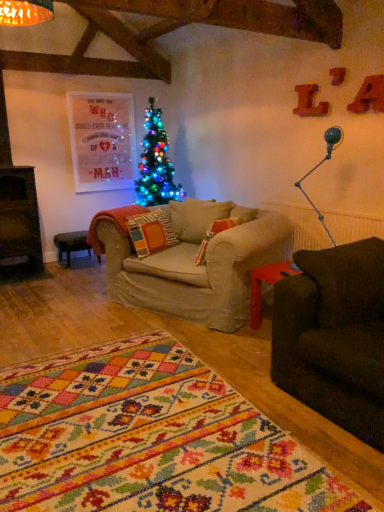
Describe the element at coordinates (319, 166) in the screenshot. I see `metallic blue lamp at right` at that location.

Where is `metallic blue lamp at right`? metallic blue lamp at right is located at coordinates (319, 166).

This screenshot has width=384, height=512. Describe the element at coordinates (71, 244) in the screenshot. I see `black leather stool at lower left` at that location.

Image resolution: width=384 pixels, height=512 pixels. I want to click on black leather stool at lower left, so click(71, 244).

Measure the distance between black leather stool at lower left and camera.

A distance of 4.59 meters exists between black leather stool at lower left and camera.

Locate an element on the screen. metallic blue lamp at right is located at coordinates (319, 166).

Which is more to the left, metallic blue lamp at right or black leather stool at lower left?

Positioned to the left is black leather stool at lower left.

In the image, is metallic blue lamp at right positioned in front of or behind black leather stool at lower left?

In the image, metallic blue lamp at right appears in front of black leather stool at lower left.

Is point (312, 206) farther from camera compared to point (74, 237)?

No, it is not.

From the image's perspective, is metallic blue lamp at right above black leather stool at lower left?

Yes, from the image's perspective, metallic blue lamp at right is on top of black leather stool at lower left.

From a real-world perspective, is metallic blue lamp at right over black leather stool at lower left?

Correct, in the physical world, metallic blue lamp at right is higher than black leather stool at lower left.

Considering the relative sizes of metallic blue lamp at right and black leather stool at lower left in the image provided, is metallic blue lamp at right thinner than black leather stool at lower left?

Indeed, metallic blue lamp at right has a lesser width compared to black leather stool at lower left.

Looking at this image, is metallic blue lamp at right shorter than black leather stool at lower left?

Incorrect, the height of metallic blue lamp at right does not fall short of that of black leather stool at lower left.

Who is smaller, metallic blue lamp at right or black leather stool at lower left?

metallic blue lamp at right is smaller.

Would you say metallic blue lamp at right is inside or outside black leather stool at lower left?

metallic blue lamp at right is located beyond the bounds of black leather stool at lower left.

Is metallic blue lamp at right directly adjacent to black leather stool at lower left?

metallic blue lamp at right and black leather stool at lower left are clearly separated.

Is metallic blue lamp at right oriented towards black leather stool at lower left?

No, metallic blue lamp at right does not turn towards black leather stool at lower left.

How different are the orientations of metallic blue lamp at right and black leather stool at lower left in degrees?

88 degrees separate the facing orientations of metallic blue lamp at right and black leather stool at lower left.

In order to click on lamp in front of the black leather stool at lower left in this screenshot , I will do `click(319, 166)`.

Can you confirm if black leather stool at lower left is positioned to the right of metallic blue lamp at right?

In fact, black leather stool at lower left is to the left of metallic blue lamp at right.

Which object is closer to the camera, black leather stool at lower left or metallic blue lamp at right?

Positioned in front is metallic blue lamp at right.

Between point (81, 232) and point (336, 144), which one is positioned behind?

Point (81, 232)

From the image's perspective, which one is positioned higher, black leather stool at lower left or metallic blue lamp at right?

From the image's view, metallic blue lamp at right is above.

From a real-world perspective, between black leather stool at lower left and metallic blue lamp at right, who is vertically lower?

In real-world perspective, black leather stool at lower left is lower.

Between black leather stool at lower left and metallic blue lamp at right, which one has larger width?

With larger width is black leather stool at lower left.

Is black leather stool at lower left taller or shorter than metallic blue lamp at right?

Considering their sizes, black leather stool at lower left has less height than metallic blue lamp at right.

Looking at the image, does black leather stool at lower left seem bigger or smaller compared to metallic blue lamp at right?

Clearly, black leather stool at lower left is larger in size than metallic blue lamp at right.

Can we say black leather stool at lower left lies outside metallic blue lamp at right?

black leather stool at lower left is positioned outside metallic blue lamp at right.

Is black leather stool at lower left touching metallic blue lamp at right?

No, black leather stool at lower left is not beside metallic blue lamp at right.

Could you tell me if black leather stool at lower left is facing metallic blue lamp at right?

Yes, black leather stool at lower left faces towards metallic blue lamp at right.

Find the location of a particular element. The width and height of the screenshot is (384, 512). table below the metallic blue lamp at right (from a real-world perspective) is located at coordinates (71, 244).

Where is `lamp above the black leather stool at lower left (from the image's perspective)`? The width and height of the screenshot is (384, 512). lamp above the black leather stool at lower left (from the image's perspective) is located at coordinates (319, 166).

Where is `lamp lying on the right of black leather stool at lower left`? The width and height of the screenshot is (384, 512). lamp lying on the right of black leather stool at lower left is located at coordinates (319, 166).